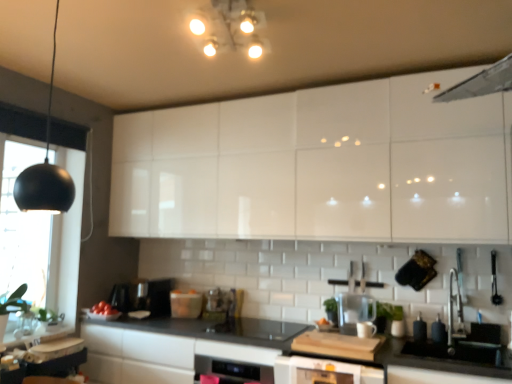
Question: Is white glossy cabinets at upper center smaller than white glossy dishwasher at center?

Choices:
 (A) yes
 (B) no

Answer: (B)

Question: Can you confirm if white glossy cabinets at upper center is thinner than white glossy dishwasher at center?

Choices:
 (A) yes
 (B) no

Answer: (A)

Question: Is white glossy cabinets at upper center at the left side of white glossy dishwasher at center?

Choices:
 (A) yes
 (B) no

Answer: (B)

Question: Is white glossy cabinets at upper center closer to the viewer compared to white glossy dishwasher at center?

Choices:
 (A) no
 (B) yes

Answer: (B)

Question: Can you confirm if white glossy cabinets at upper center is bigger than white glossy dishwasher at center?

Choices:
 (A) yes
 (B) no

Answer: (A)

Question: From a real-world perspective, is white glossy cabinets at upper center positioned over white glossy dishwasher at center based on gravity?

Choices:
 (A) no
 (B) yes

Answer: (B)

Question: Is white glossy dishwasher at center far from white glossy light fixture at upper center, the 1th light fixture positioned from the right?

Choices:
 (A) no
 (B) yes

Answer: (B)

Question: From the image's perspective, is white glossy dishwasher at center below white glossy light fixture at upper center, the 1th light fixture positioned from the right?

Choices:
 (A) yes
 (B) no

Answer: (A)

Question: From a real-world perspective, is white glossy dishwasher at center on top of white glossy light fixture at upper center, the second light fixture positioned from the left?

Choices:
 (A) no
 (B) yes

Answer: (A)

Question: Is white glossy dishwasher at center facing away from white glossy light fixture at upper center, acting as the second light fixture starting from the bottom?

Choices:
 (A) no
 (B) yes

Answer: (A)

Question: Is white glossy dishwasher at center closer to the viewer compared to white glossy light fixture at upper center, acting as the second light fixture starting from the bottom?

Choices:
 (A) no
 (B) yes

Answer: (A)

Question: From a real-world perspective, is white glossy dishwasher at center physically below white glossy light fixture at upper center, the second light fixture positioned from the left?

Choices:
 (A) yes
 (B) no

Answer: (A)

Question: From a real-world perspective, does matte plastic container at center, the fourth appliance when ordered from right to left, stand above matte black soap dispenser at lower right, the fourth appliance positioned from the back?

Choices:
 (A) yes
 (B) no

Answer: (A)